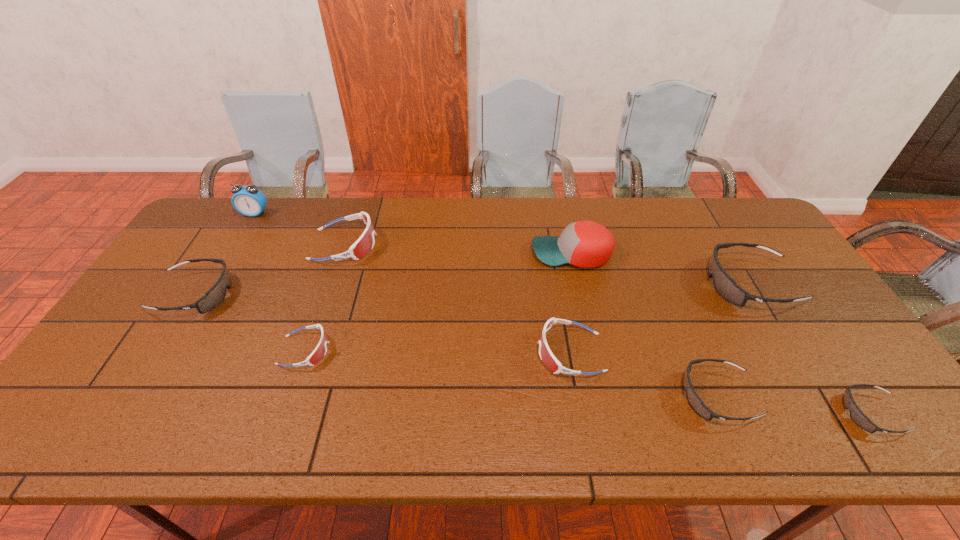
The image size is (960, 540). I want to click on the farthest object, so click(x=248, y=200).

Find the location of a particular element. red baseball cap is located at coordinates (586, 244).

Find the location of a particular element. the farthest red goggles is located at coordinates [x=365, y=243].

Locate an element on the screen. The height and width of the screenshot is (540, 960). the biggest black goggles is located at coordinates (725, 286).

I want to click on the leftmost goggles, so click(213, 297).

Locate an element on the screen. the second biggest black goggles is located at coordinates (213, 297).

Where is `the fourth goggles from right to left`? This screenshot has width=960, height=540. the fourth goggles from right to left is located at coordinates click(547, 357).

This screenshot has height=540, width=960. What are the coordinates of `the second biggest red goggles` in the screenshot? It's located at (547, 357).

At what (x,y) coordinates should I click in order to perform the action: click on the third biggest black goggles. Please return your answer as a coordinate pair (x, y). The height and width of the screenshot is (540, 960). Looking at the image, I should click on (694, 400).

This screenshot has width=960, height=540. In order to click on the fifth goggles from left to right in this screenshot , I will do `click(694, 400)`.